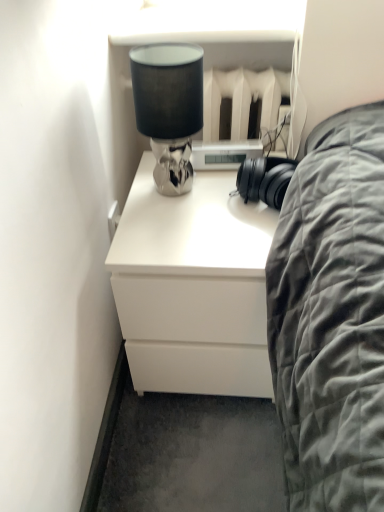
The width and height of the screenshot is (384, 512). In order to click on empty space that is ontop of white matte chest of drawers at center (from a real-world perspective) in this screenshot , I will do 195,200.